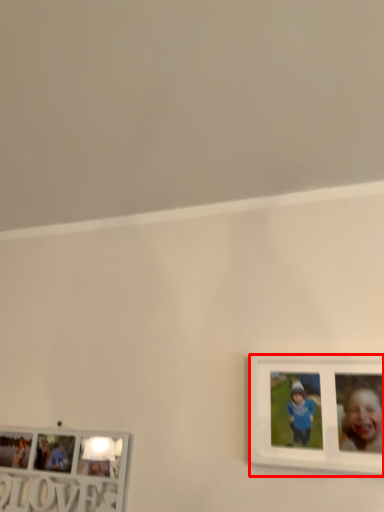
Question: Where is picture frame (annotated by the red box) located in relation to picture frame in the image?

Choices:
 (A) right
 (B) left

Answer: (A)